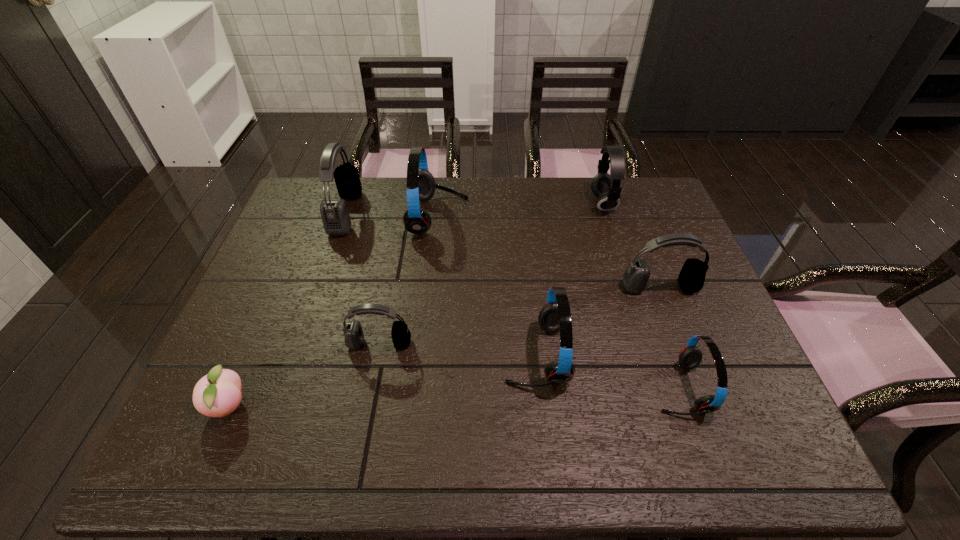
This screenshot has width=960, height=540. Identify the location of free location located with the microphone attached to the side of the fourth headset from left to right. (389, 354).

Locate an element on the screen. Image resolution: width=960 pixels, height=540 pixels. blank space located with the microphone attached to the side of the fourth headset from left to right is located at coordinates (389, 354).

Locate an element on the screen. This screenshot has height=540, width=960. vacant position located with the microphone attached to the side of the fourth headset from left to right is located at coordinates (347, 354).

At what (x,y) coordinates should I click in order to perform the action: click on vacant space located 0.250m on the headband of the smallest black headset. Please return your answer as a coordinate pair (x, y). The image size is (960, 540). Looking at the image, I should click on (358, 457).

The height and width of the screenshot is (540, 960). Find the location of `free space located 0.120m with the microphone attached to the side of the smallest red headset`. free space located 0.120m with the microphone attached to the side of the smallest red headset is located at coordinates (600, 388).

Locate an element on the screen. This screenshot has width=960, height=540. vacant area situated with the microphone attached to the side of the smallest red headset is located at coordinates (582, 388).

Where is `free space located with the microphone attached to the side of the smallest red headset`? free space located with the microphone attached to the side of the smallest red headset is located at coordinates (537, 388).

The width and height of the screenshot is (960, 540). Find the location of `free space located 0.140m on the back of the leftmost object`. free space located 0.140m on the back of the leftmost object is located at coordinates (260, 334).

This screenshot has width=960, height=540. What are the coordinates of `earphone located at the far edge` in the screenshot? It's located at (606, 187).

Find the location of a particular element. object that is at the near edge is located at coordinates (217, 394).